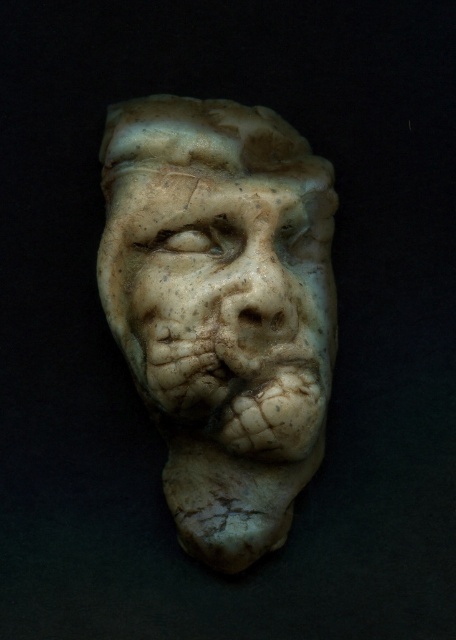
You are a photographer who wants to capture a detailed closeup of the white marble sculpture at center. Your camera has a minimum focusing distance of 1 meter. Can you take the photo without moving the sculpture or the camera?

The white marble sculpture at center and camera are 1.27 meters apart, which is beyond the camera minimum focusing distance of 1 meter. So yes, the photographer can take the photo without moving the sculpture or the camera.

You are an archaeologist examining the white marble sculpture at center and the marble sculpture of face at center. Since you need to measure the distance between them for documentation, can you confirm if they are less than half an inch apart?

The white marble sculpture at center and marble sculpture of face at center are 0.47 inches apart from each other, so yes, they are less than half an inch apart.

You are an art conservator examining the white marble sculpture at center and the marble sculpture of face at center. Which sculpture is wider?

The white marble sculpture at center is wider than the marble sculpture of face at center.